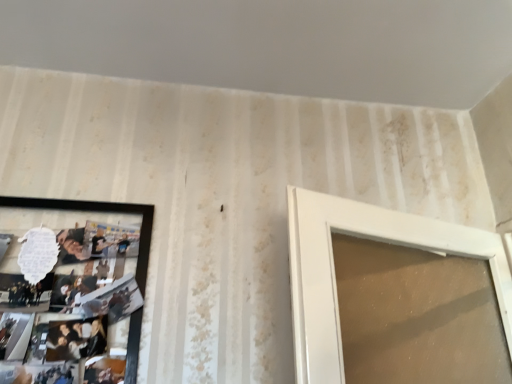
What do you see at coordinates (103, 211) in the screenshot? I see `black matte picture frame at upper left` at bounding box center [103, 211].

This screenshot has width=512, height=384. What are the coordinates of `black matte picture frame at upper left` in the screenshot? It's located at (103, 211).

The height and width of the screenshot is (384, 512). I want to click on black matte picture frame at upper left, so click(x=103, y=211).